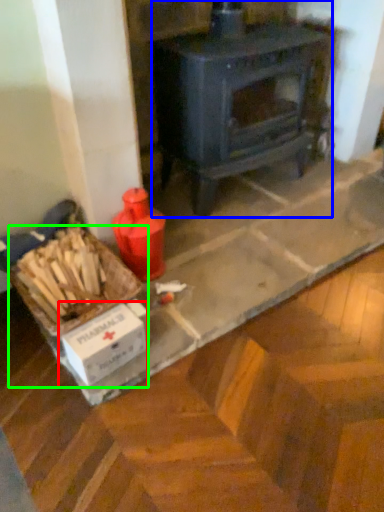
Question: Which object is the closest to the cardboard box (highlighted by a red box)? Choose among these: wood burning stove (highlighted by a blue box) or box (highlighted by a green box).

Choices:
 (A) wood burning stove
 (B) box

Answer: (B)